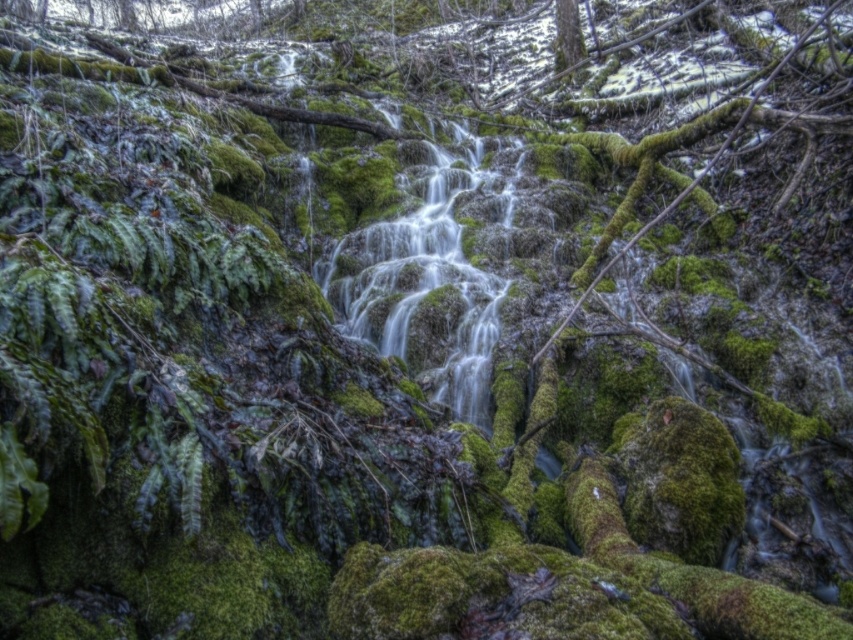
You are a hiker navigating through the mossy landscape. You need to cross the stream but want to stay as close as possible to the tree for shade. Which direction should you head relative to the green mossy tree at upper center to reach the green mossy stream at center?

You should head downward from the green mossy tree at upper center to reach the green mossy stream at center, as the stream is located below the tree.

You are a hiker trying to reach the green mossy tree at upper center. You are currently standing near the green mossy stream at center. Which direction should you move to get closer to the tree?

Since the green mossy stream at center is in front of the green mossy tree at upper center, you should move backward away from the stream to get closer to the tree.

You are a hiker who wants to cross the green mossy stream at center. You notice a green mossy tree at upper center nearby. Which one is closer to the ground?

The green mossy stream at center is closer to the ground because it is shorter than the green mossy tree at upper center.